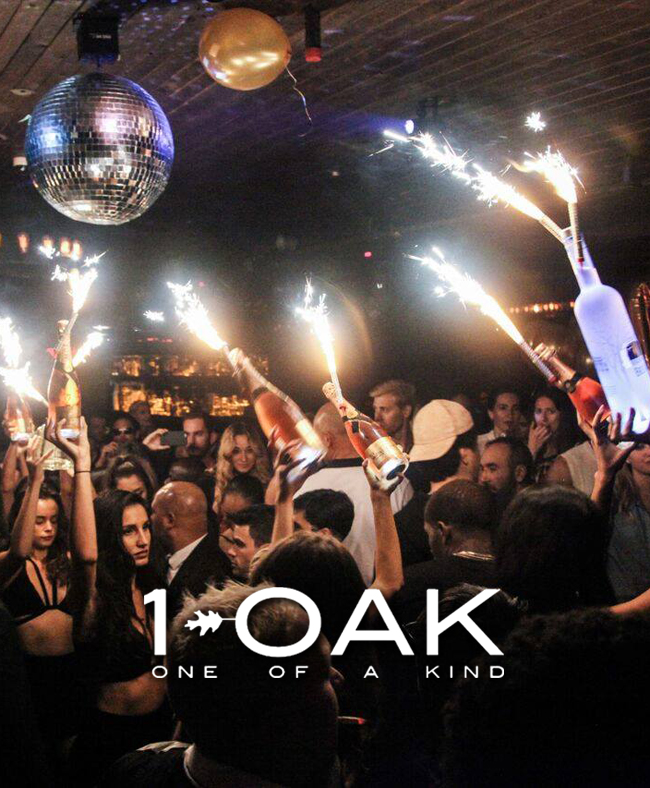
Where is `lights`? lights is located at coordinates (538, 311).